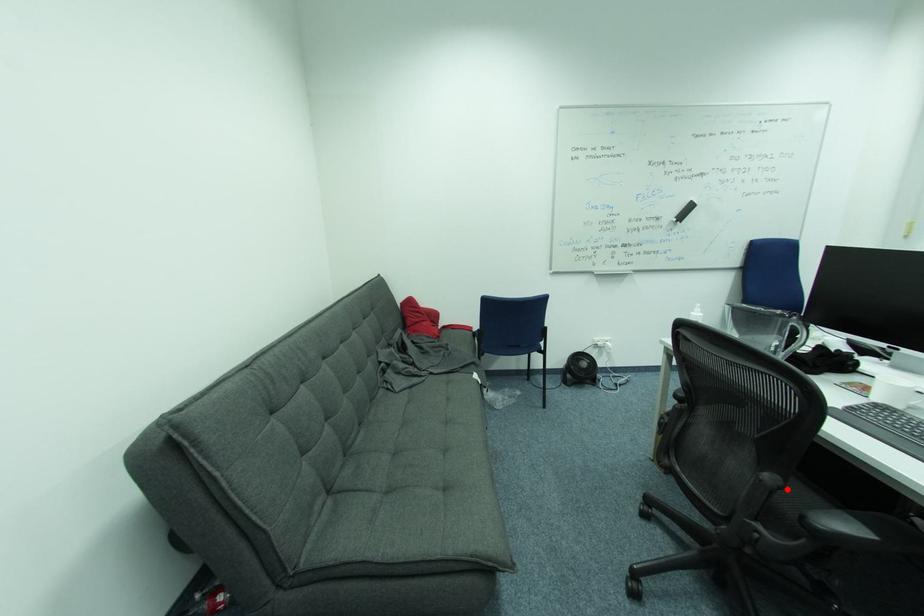
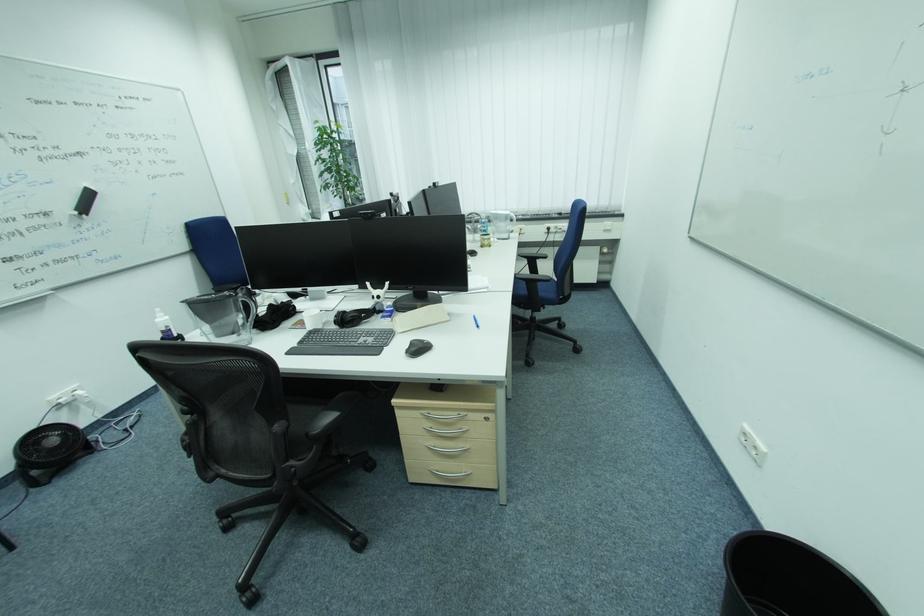
The point at the highlighted location is marked in the first image. Where is the corresponding point in the second image?

(294, 429)